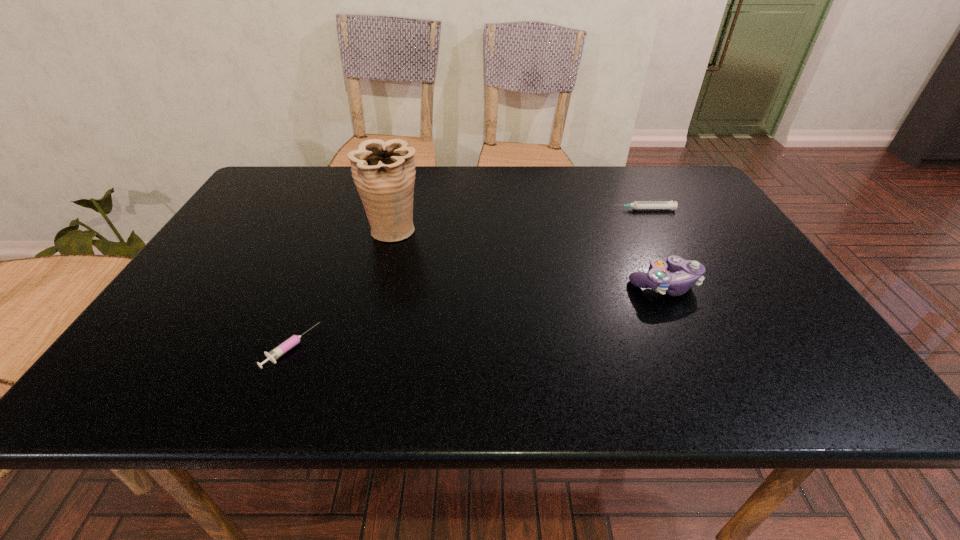
Image resolution: width=960 pixels, height=540 pixels. In the image, there is a desktop. In order to click on vacant space at the far right corner in this screenshot , I will do `click(689, 190)`.

Identify the location of vacant region between the nearer syringe and the farther syringe. (468, 278).

This screenshot has width=960, height=540. I want to click on empty location between the right syringe and the nearer syringe, so click(468, 278).

Locate an element on the screen. This screenshot has height=540, width=960. empty location between the second nearest object and the left syringe is located at coordinates (477, 316).

Locate an element on the screen. Image resolution: width=960 pixels, height=540 pixels. vacant area that lies between the third shortest object and the leftmost object is located at coordinates (477, 316).

I want to click on free spot between the control and the tallest object, so click(528, 257).

Identify the location of empty space between the second farthest object and the third farthest object. (528, 257).

This screenshot has height=540, width=960. In order to click on vacant area that lies between the second nearest object and the farthest object in this screenshot , I will do `click(653, 247)`.

The image size is (960, 540). In order to click on empty location between the farther syringe and the second tallest object in this screenshot , I will do `click(653, 247)`.

Find the location of a particular element. free space between the farthest object and the control is located at coordinates (653, 247).